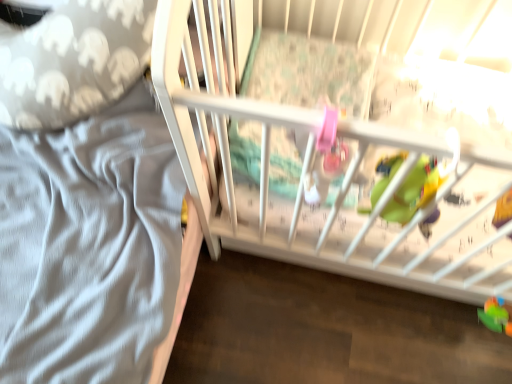
Question: Can you confirm if rubberized green toy at lower right, the first toy in the front-to-back sequence, is positioned to the right of green plastic toy at lower right, acting as the 2th toy starting from the top?

Choices:
 (A) no
 (B) yes

Answer: (A)

Question: From the image's perspective, is rubberized green toy at lower right, the first toy from the left, located beneath green plastic toy at lower right, which appears as the first toy when ordered from the bottom?

Choices:
 (A) yes
 (B) no

Answer: (B)

Question: Is rubberized green toy at lower right, the first toy from the left, oriented towards green plastic toy at lower right, which appears as the first toy when viewed from the back?

Choices:
 (A) yes
 (B) no

Answer: (B)

Question: Can you confirm if rubberized green toy at lower right, the first toy from the left, is smaller than green plastic toy at lower right, which appears as the first toy when viewed from the back?

Choices:
 (A) yes
 (B) no

Answer: (B)

Question: Is rubberized green toy at lower right, acting as the 1th toy starting from the top, to the left of green plastic toy at lower right, which appears as the first toy when ordered from the bottom, from the viewer's perspective?

Choices:
 (A) no
 (B) yes

Answer: (B)

Question: In the image, is green plastic toy at lower right, which appears as the first toy when ordered from the bottom, positioned in front of or behind gray elephant-patterned pillow at left?

Choices:
 (A) front
 (B) behind

Answer: (B)

Question: Considering the positions of green plastic toy at lower right, the 1th toy in the right-to-left sequence, and gray elephant-patterned pillow at left in the image, is green plastic toy at lower right, the 1th toy in the right-to-left sequence, wider or thinner than gray elephant-patterned pillow at left?

Choices:
 (A) thin
 (B) wide

Answer: (A)

Question: In the image, is green plastic toy at lower right, the 1th toy in the right-to-left sequence, on the left side or the right side of gray elephant-patterned pillow at left?

Choices:
 (A) right
 (B) left

Answer: (A)

Question: From the image's perspective, is green plastic toy at lower right, which appears as the first toy when ordered from the bottom, above or below gray elephant-patterned pillow at left?

Choices:
 (A) below
 (B) above

Answer: (A)

Question: Considering the positions of rubberized green toy at lower right, acting as the 1th toy starting from the top, and green plastic toy at lower right, which appears as the first toy when ordered from the bottom, in the image, is rubberized green toy at lower right, acting as the 1th toy starting from the top, taller or shorter than green plastic toy at lower right, which appears as the first toy when ordered from the bottom,?

Choices:
 (A) short
 (B) tall

Answer: (B)

Question: Considering the positions of rubberized green toy at lower right, marked as the second toy in a bottom-to-top arrangement, and green plastic toy at lower right, which appears as the first toy when viewed from the back, in the image, is rubberized green toy at lower right, marked as the second toy in a bottom-to-top arrangement, bigger or smaller than green plastic toy at lower right, which appears as the first toy when viewed from the back,?

Choices:
 (A) big
 (B) small

Answer: (A)

Question: Is rubberized green toy at lower right, the first toy in the front-to-back sequence, inside the boundaries of green plastic toy at lower right, the 1th toy in the right-to-left sequence, or outside?

Choices:
 (A) outside
 (B) inside

Answer: (A)

Question: Considering their positions, is rubberized green toy at lower right, the first toy from the left, located in front of or behind green plastic toy at lower right, the 2th toy when ordered from left to right?

Choices:
 (A) behind
 (B) front

Answer: (B)

Question: Considering the positions of point (83, 91) and point (510, 198), is point (83, 91) closer or farther from the camera than point (510, 198)?

Choices:
 (A) farther
 (B) closer

Answer: (B)

Question: Looking at their shapes, would you say gray elephant-patterned pillow at left is wider or thinner than rubberized green toy at lower right, which ranks as the second toy in right-to-left order?

Choices:
 (A) thin
 (B) wide

Answer: (B)